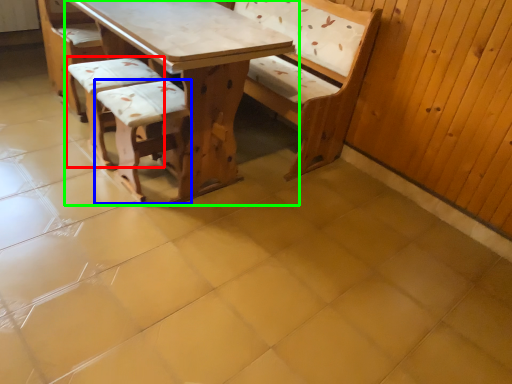
Question: Which object is the farthest from armchair (highlighted by a red box)? Choose among these: armchair (highlighted by a blue box) or table (highlighted by a green box).

Choices:
 (A) armchair
 (B) table

Answer: (B)